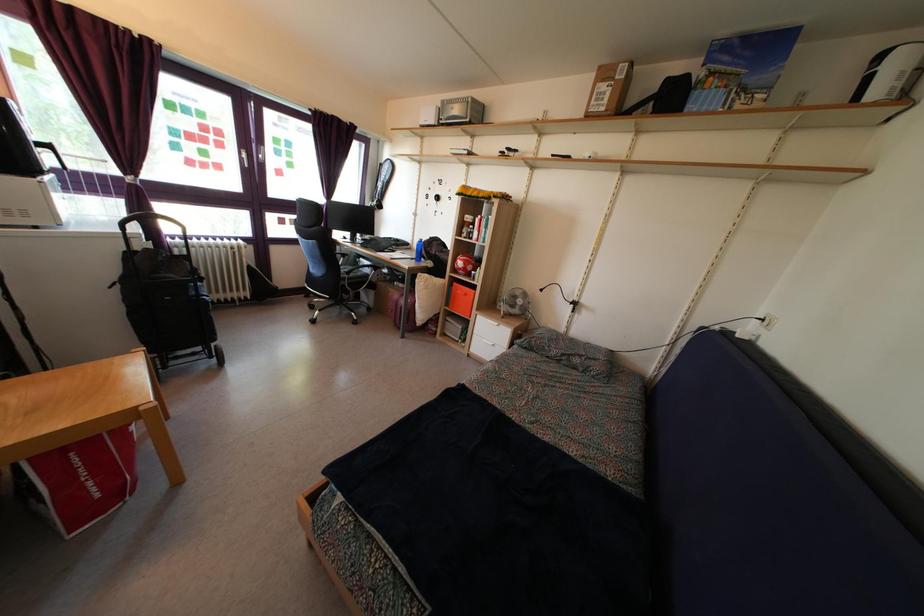
Where would you resting arm the black chair armrest? Please return your answer as a coordinate pair (x, y).

(362, 268)